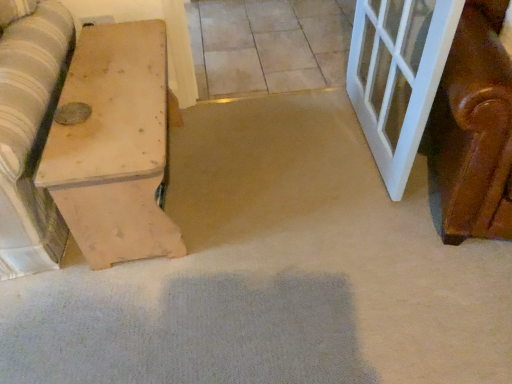
Locate an element on the screen. The width and height of the screenshot is (512, 384). free space above neutral stone tile at center (from a real-world perspective) is located at coordinates (283, 41).